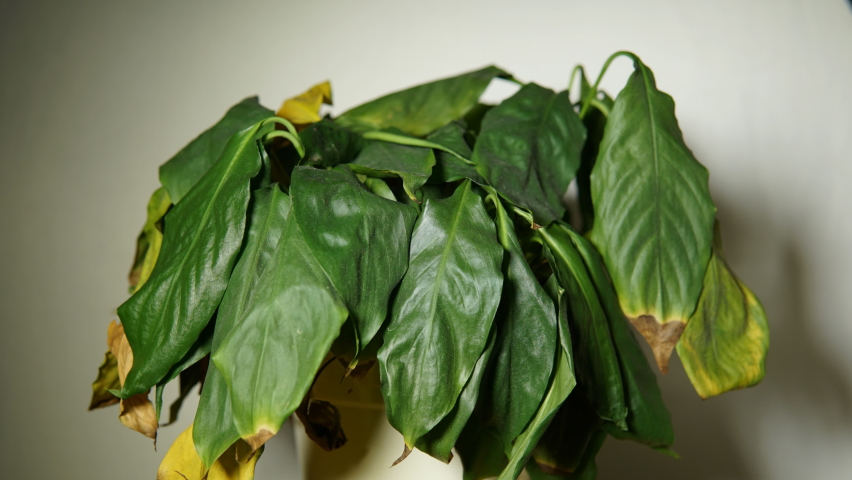
Find the location of a particular element. This screenshot has height=480, width=852. pot is located at coordinates (367, 449).